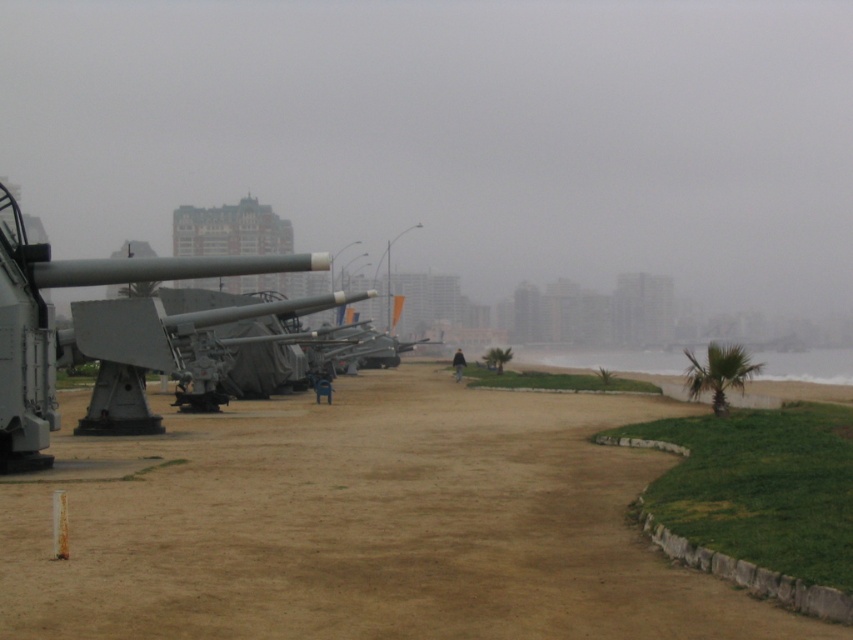
Question: Which of the following is the farthest from the observer?

Choices:
 (A) (148, 552)
 (B) (117, 362)

Answer: (B)

Question: Which point is closer to the camera?

Choices:
 (A) brown sandy dirt at center
 (B) gray metallic cannon at left

Answer: (A)

Question: In this image, where is brown sandy dirt at center located relative to gray metallic cannon at left?

Choices:
 (A) above
 (B) below

Answer: (B)

Question: Is brown sandy dirt at center to the right of gray metallic cannon at left from the viewer's perspective?

Choices:
 (A) yes
 (B) no

Answer: (A)

Question: Is brown sandy dirt at center above gray metallic cannon at left?

Choices:
 (A) no
 (B) yes

Answer: (A)